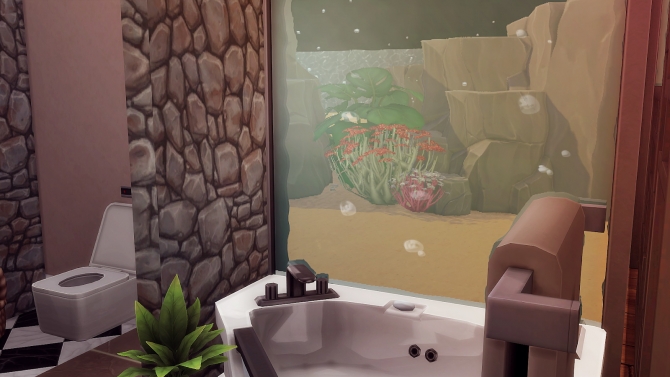
Locate an element on the screen. The image size is (670, 377). light grey towel rack is located at coordinates (536, 324).